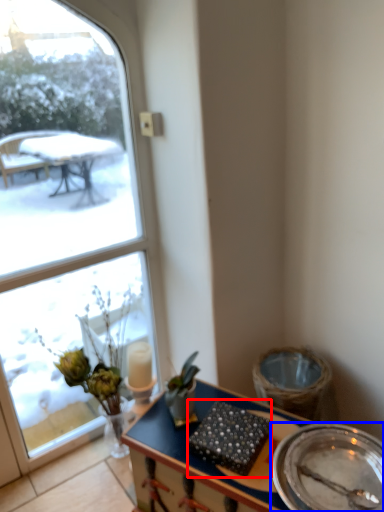
Question: Which object appears farthest to the camera in this image, food (highlighted by a red box) or plate (highlighted by a blue box)?

Choices:
 (A) food
 (B) plate

Answer: (A)